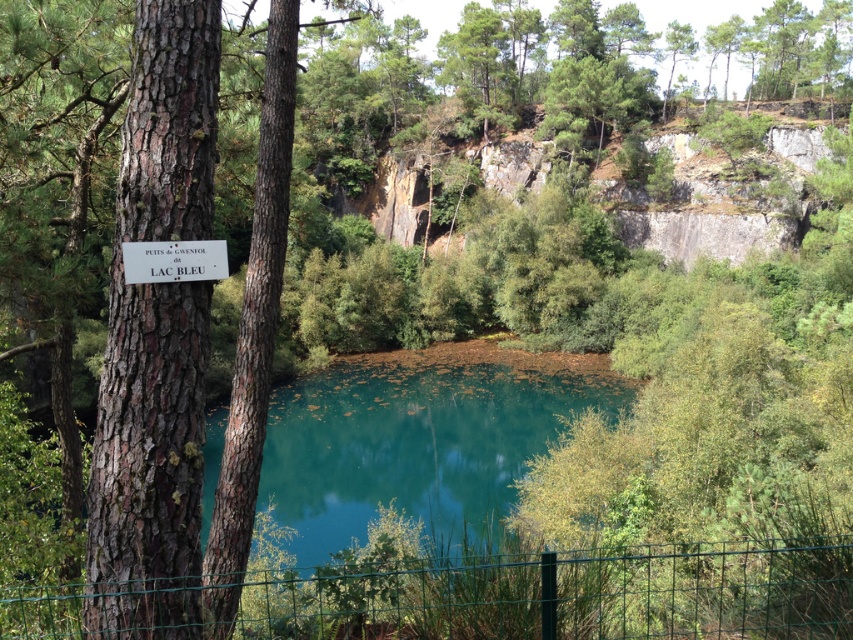
Question: Which point is closer to the camera taking this photo?

Choices:
 (A) (213, 262)
 (B) (608, 364)
 (C) (190, 300)

Answer: (C)

Question: Can you confirm if green wire mesh at lower center is thinner than teal glossy water at center?

Choices:
 (A) yes
 (B) no

Answer: (A)

Question: Is teal glossy water at center thinner than white wooden sign at upper left?

Choices:
 (A) no
 (B) yes

Answer: (A)

Question: Is green wire mesh at lower center below white wooden sign at upper left?

Choices:
 (A) no
 (B) yes

Answer: (B)

Question: Which object is closer to the camera taking this photo?

Choices:
 (A) white wooden sign at upper left
 (B) teal glossy water at center

Answer: (A)

Question: Which point is closer to the camera?

Choices:
 (A) (178, 202)
 (B) (480, 404)
 (C) (143, 275)
 (D) (67, 627)

Answer: (C)